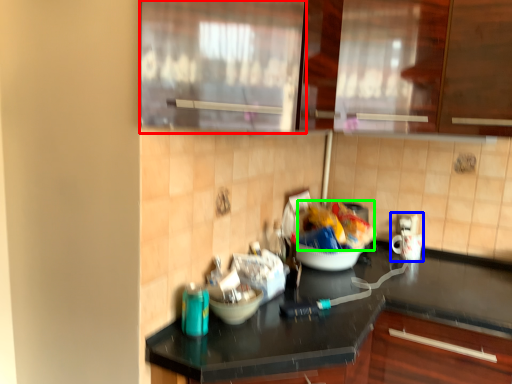
Question: Which is nearer to the glass door (highlighted by a red box)? appliance (highlighted by a blue box) or food (highlighted by a green box).

Choices:
 (A) appliance
 (B) food

Answer: (B)